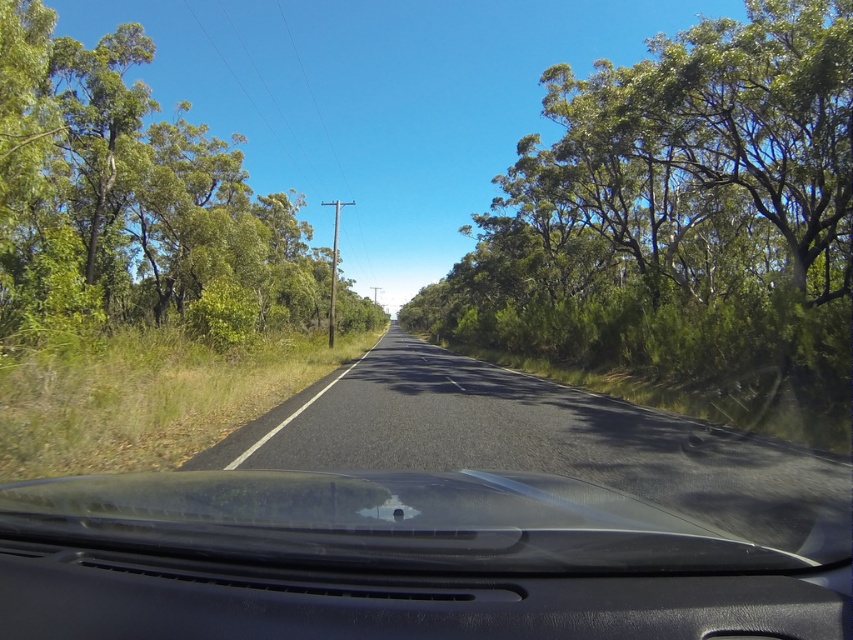
Who is more forward, (463, 308) or (252, 636)?

Point (252, 636) is more forward.

Is green leafy tree at center smaller than black matte dashboard at center?

No, green leafy tree at center is not smaller than black matte dashboard at center.

This screenshot has width=853, height=640. What are the coordinates of `green leafy tree at center` in the screenshot? It's located at (679, 204).

In order to click on green leafy tree at center in this screenshot , I will do pyautogui.click(x=679, y=204).

Does green leafy tree at center have a greater width compared to green leafy tree at left?

In fact, green leafy tree at center might be narrower than green leafy tree at left.

Is green leafy tree at center above green leafy tree at left?

No, green leafy tree at center is not above green leafy tree at left.

Is point (686, 230) positioned in front of point (33, 230)?

That is False.

Locate an element on the screen. The height and width of the screenshot is (640, 853). green leafy tree at center is located at coordinates (679, 204).

Who is taller, green leafy tree at left or black matte dashboard at center?

green leafy tree at left is taller.

Which is behind, point (115, 164) or point (1, 561)?

Positioned behind is point (115, 164).

Locate an element on the screen. This screenshot has width=853, height=640. green leafy tree at left is located at coordinates (132, 198).